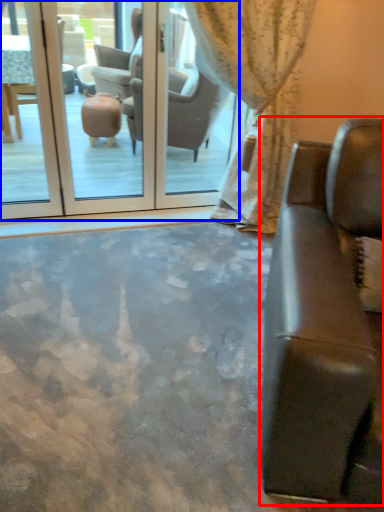
Question: Which point is closer to the camera, studio couch (highlighted by a red box) or screen door (highlighted by a blue box)?

Choices:
 (A) studio couch
 (B) screen door

Answer: (A)